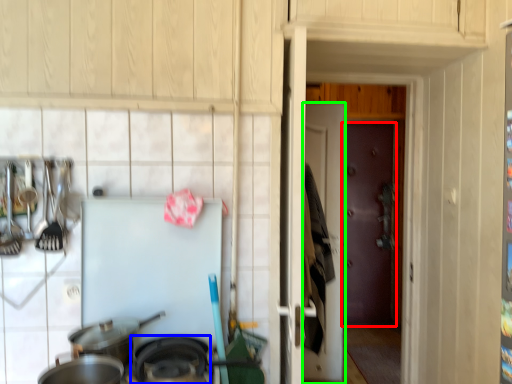
Question: Estimate the real-world distances between objects in this image. Which object is farther from door (highlighted by a red box), wok (highlighted by a blue box) or door (highlighted by a green box)?

Choices:
 (A) wok
 (B) door

Answer: (A)